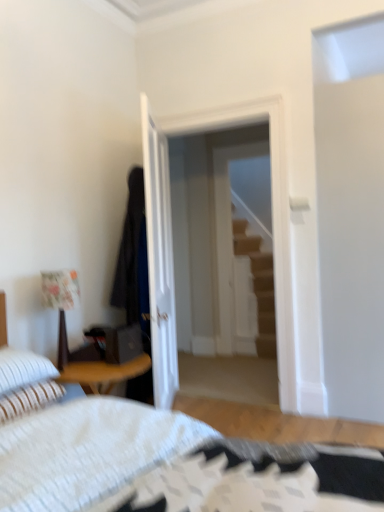
Question: Is floral fabric lampshade at left oriented away from white glossy door at center?

Choices:
 (A) no
 (B) yes

Answer: (A)

Question: From a real-world perspective, is floral fabric lampshade at left under white glossy door at center?

Choices:
 (A) no
 (B) yes

Answer: (B)

Question: Is floral fabric lampshade at left facing towards white glossy door at center?

Choices:
 (A) yes
 (B) no

Answer: (B)

Question: Is floral fabric lampshade at left further to the viewer compared to white glossy door at center?

Choices:
 (A) no
 (B) yes

Answer: (A)

Question: From the image's perspective, is floral fabric lampshade at left beneath white glossy door at center?

Choices:
 (A) yes
 (B) no

Answer: (A)

Question: Considering the relative sizes of floral fabric lampshade at left and white glossy door at center in the image provided, is floral fabric lampshade at left wider than white glossy door at center?

Choices:
 (A) yes
 (B) no

Answer: (A)

Question: Is white striped pillow at lower left, which appears as the second pillow when ordered from the bottom, looking in the opposite direction of white striped pillow at lower left, which is the 2th pillow from top to bottom?

Choices:
 (A) no
 (B) yes

Answer: (A)

Question: Would you say white striped pillow at lower left, which is the 2th pillow from top to bottom, is part of white striped pillow at lower left, which appears as the second pillow when ordered from the bottom,'s contents?

Choices:
 (A) no
 (B) yes

Answer: (A)

Question: From the image's perspective, is white striped pillow at lower left, the first pillow viewed from the top, under white striped pillow at lower left, positioned as the first pillow in bottom-to-top order?

Choices:
 (A) yes
 (B) no

Answer: (B)

Question: From a real-world perspective, is white striped pillow at lower left, which appears as the second pillow when ordered from the bottom, physically above white striped pillow at lower left, positioned as the first pillow in bottom-to-top order?

Choices:
 (A) yes
 (B) no

Answer: (A)

Question: Considering the relative sizes of white striped pillow at lower left, which appears as the second pillow when ordered from the bottom, and white striped pillow at lower left, positioned as the first pillow in bottom-to-top order, in the image provided, is white striped pillow at lower left, which appears as the second pillow when ordered from the bottom, bigger than white striped pillow at lower left, positioned as the first pillow in bottom-to-top order,?

Choices:
 (A) no
 (B) yes

Answer: (B)

Question: Considering the relative sizes of white striped pillow at lower left, the first pillow viewed from the top, and white striped pillow at lower left, which is the 2th pillow from top to bottom, in the image provided, is white striped pillow at lower left, the first pillow viewed from the top, smaller than white striped pillow at lower left, which is the 2th pillow from top to bottom,?

Choices:
 (A) yes
 (B) no

Answer: (B)

Question: Is transparent glass door at center smaller than white striped pillow at lower left, the first pillow viewed from the top?

Choices:
 (A) yes
 (B) no

Answer: (B)